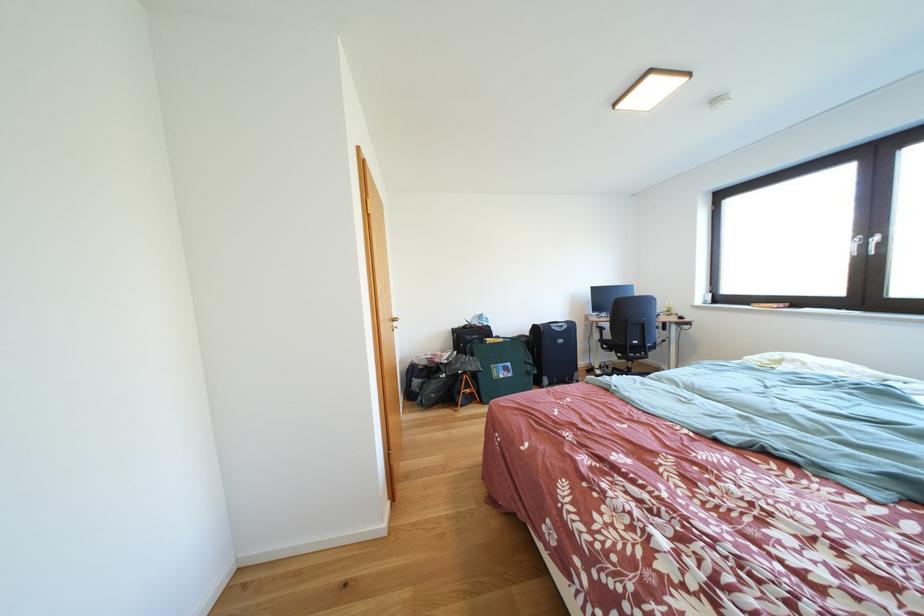
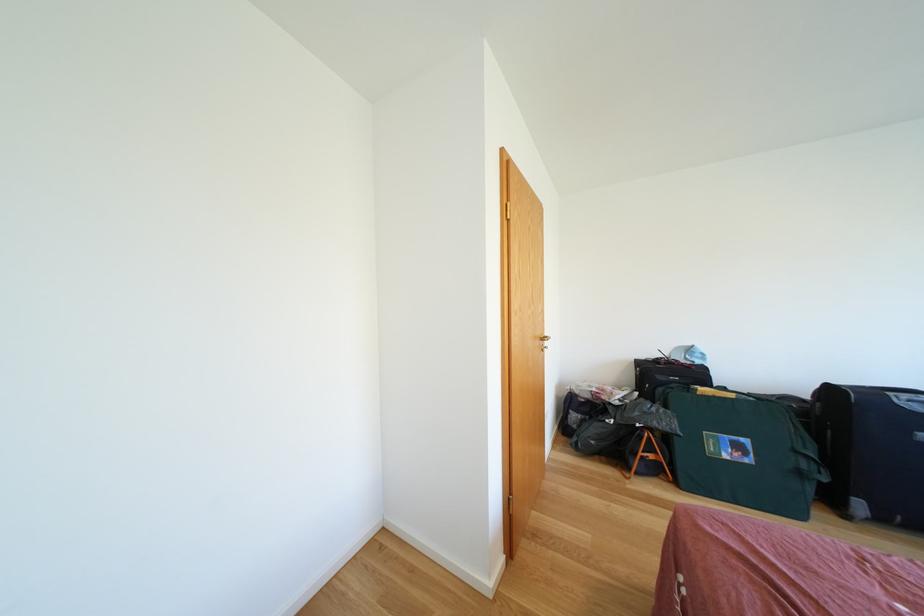
Question: The camera is either moving clockwise (left) or counter-clockwise (right) around the object. The first image is from the beginning of the video and the second image is from the end. Is the camera moving left or right when shooting the video?

Choices:
 (A) Left
 (B) Right

Answer: (B)